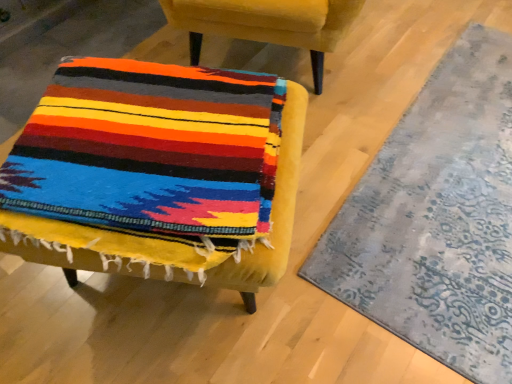
This screenshot has height=384, width=512. What are the coordinates of `free space above textured gray rug at lower right (from a real-world perspective)` in the screenshot? It's located at (437, 213).